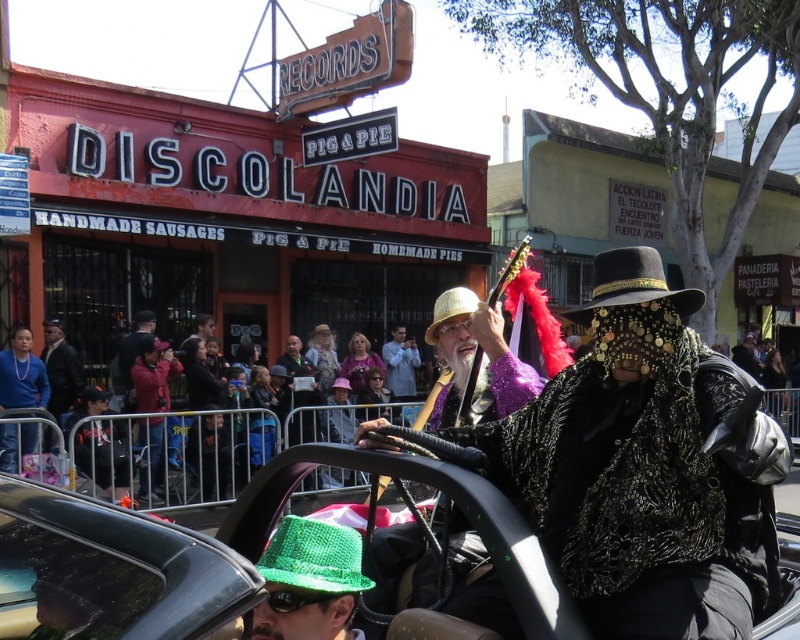
Is shiny black car at center smaller than black sequined cowboy hat at center?

Incorrect, shiny black car at center is not smaller in size than black sequined cowboy hat at center.

From the picture: Is shiny black car at center below black sequined cowboy hat at center?

Indeed, shiny black car at center is positioned under black sequined cowboy hat at center.

Is point (174, 547) less distant than point (628, 253)?

Yes, point (174, 547) is closer to viewer.

The height and width of the screenshot is (640, 800). What are the coordinates of `shiny black car at center` in the screenshot? It's located at (270, 529).

Is point (389, 352) positioned behind point (430, 336)?

Yes, point (389, 352) is behind point (430, 336).

Is point (404, 356) closer to viewer compared to point (466, 298)?

No.

What do you see at coordinates (400, 364) in the screenshot?
I see `light blue fabric jacket at center` at bounding box center [400, 364].

Find the location of `light blue fabric jacket at center`. light blue fabric jacket at center is located at coordinates (400, 364).

Is shiny black car at center to the left of light blue fabric jacket at center from the viewer's perspective?

Incorrect, shiny black car at center is not on the left side of light blue fabric jacket at center.

Can you confirm if shiny black car at center is thinner than light blue fabric jacket at center?

No.

Which is in front, point (482, 486) or point (418, 358)?

Point (482, 486) is in front.

Where is `shiny black car at center`? The image size is (800, 640). shiny black car at center is located at coordinates (270, 529).